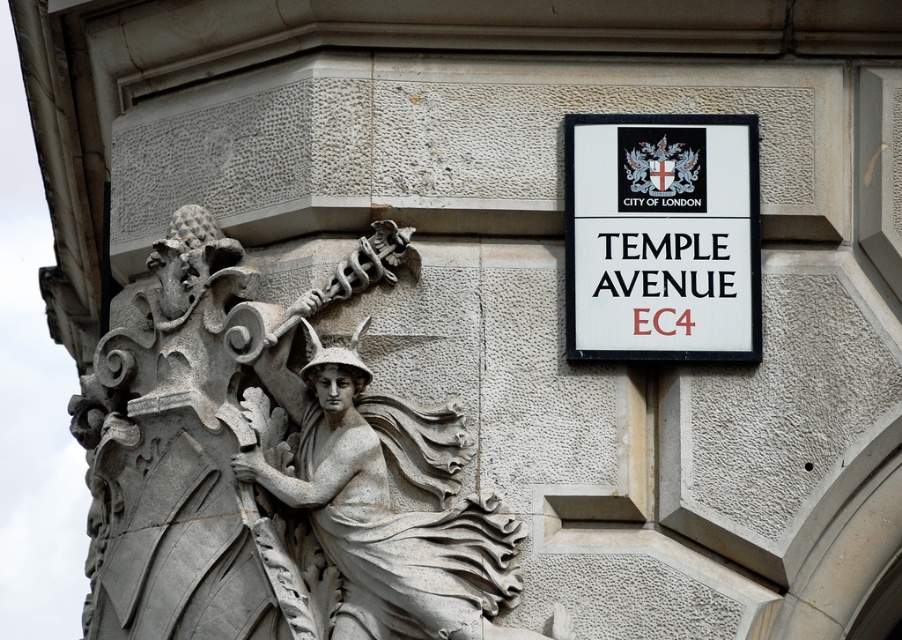
You are standing in front of the historic stone building and notice two points marked on the wall. The first point is at coordinates point (231, 371) and the second is at point (575, 288). Which point is closer to you?

Point (231, 371) is closer to the camera than point (575, 288).